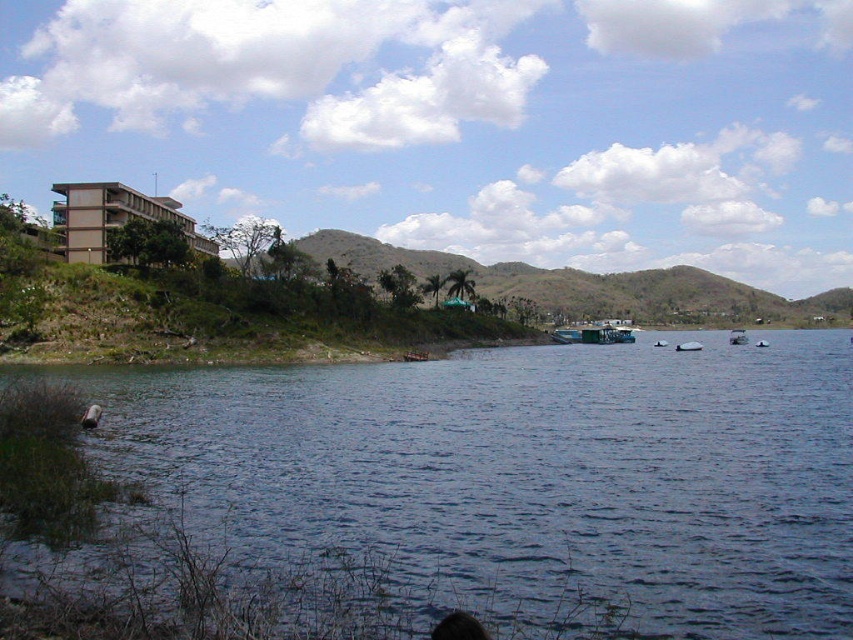
You are standing at the shoreline where the dry shrubs are. You want to reach the blue water at center. Which direction should you walk to get there?

Since the blue water at center is located at coordinates point (525,477), you should walk towards the center of the image to reach it.

You are a drone operator who needs to fly a drone between the green leafy hillside at center and the green matte boat at center. Given that the drone has a maximum flight range of 65 meters, can it successfully fly between them without needing to recharge?

The green leafy hillside at center and green matte boat at center are 64.99 meters apart from each other. Since the distance is just under the drone maximum flight range of 65 meters, the drone can successfully fly between them without needing to recharge.

You are standing on the lakeshore and see the blue water at center and the green matte boat at center. Which object appears taller from your perspective?

The green matte boat at center appears taller than the blue water at center because the blue water at center is shorter than the green matte boat at center.